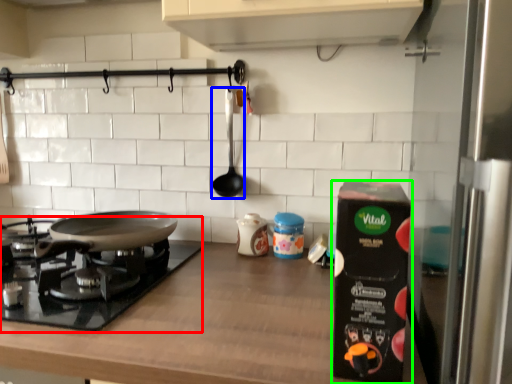
Question: Considering the real-world distances, which object is farthest from gas stove (highlighted by a red box)? utensil (highlighted by a blue box) or kitchen appliance (highlighted by a green box)?

Choices:
 (A) utensil
 (B) kitchen appliance

Answer: (B)